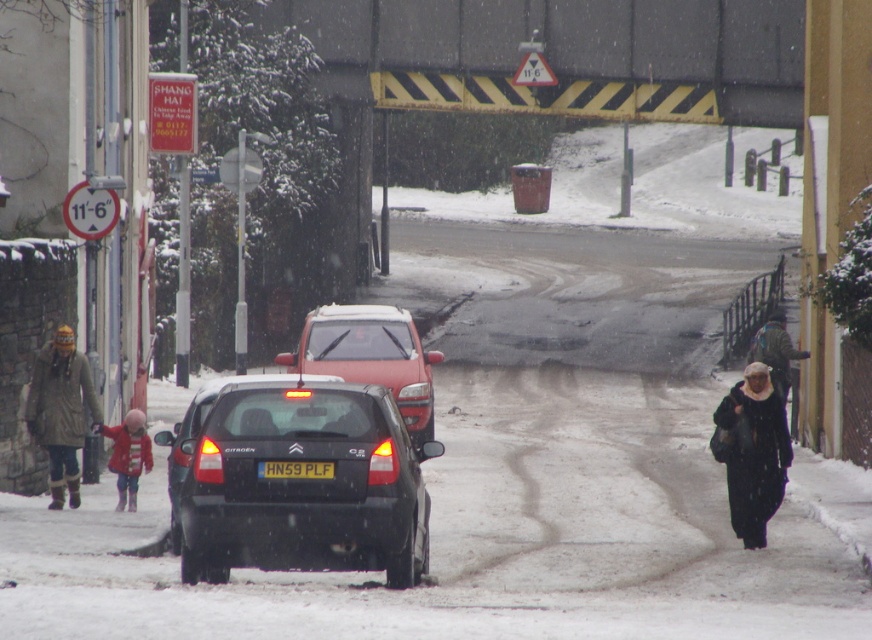
You are a delivery person standing next to the dark gray woolen coat at right. You need to deliver a package to the yellow matte license plate at center. Can you walk directly to it without crossing the road?

The dark gray woolen coat at right is 5.10 meters away from the yellow matte license plate at center. Since the objects are on the same side of the street, you can walk directly to it without crossing the road.